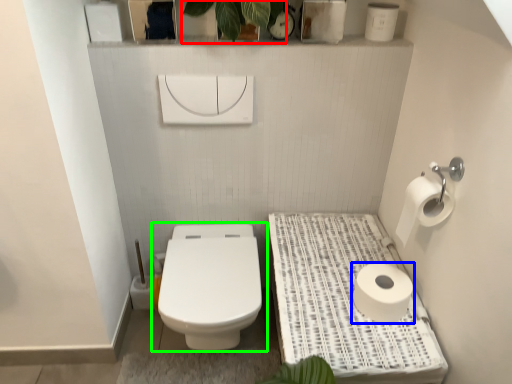
Question: Considering the real-world distances, which object is closest to plant (highlighted by a red box)? toilet paper (highlighted by a blue box) or toilet (highlighted by a green box).

Choices:
 (A) toilet paper
 (B) toilet

Answer: (B)